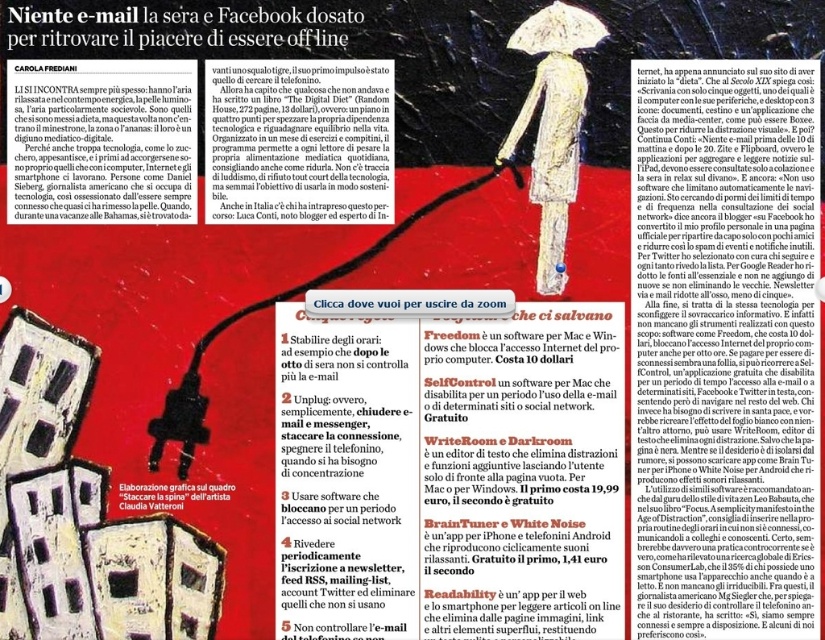
Who is lower down, white paper list at center or white matte umbrella at upper center?

white paper list at center

The height and width of the screenshot is (640, 825). Describe the element at coordinates (346, 481) in the screenshot. I see `white paper list at center` at that location.

This screenshot has width=825, height=640. Describe the element at coordinates (346, 481) in the screenshot. I see `white paper list at center` at that location.

At what (x,y) coordinates should I click in order to perform the action: click on white paper list at center. Please return your answer as a coordinate pair (x, y). Looking at the image, I should click on (346, 481).

Does white paper list at center come in front of black paper at upper center?

That is False.

Who is more forward, (417, 406) or (324, 33)?

Point (324, 33)

Does point (331, 451) lie in front of point (82, 36)?

No, (331, 451) is behind (82, 36).

Identify the location of white paper list at center. (346, 481).

Is black paper text at upper center closer to the viewer compared to black paper at upper center?

No, black paper text at upper center is further to the viewer.

Is point (262, 124) closer to camera compared to point (125, 19)?

No, (262, 124) is behind (125, 19).

Does point (350, 160) come farther from viewer compared to point (317, 22)?

Yes, it is.

Locate an element on the screen. black paper text at upper center is located at coordinates (298, 141).